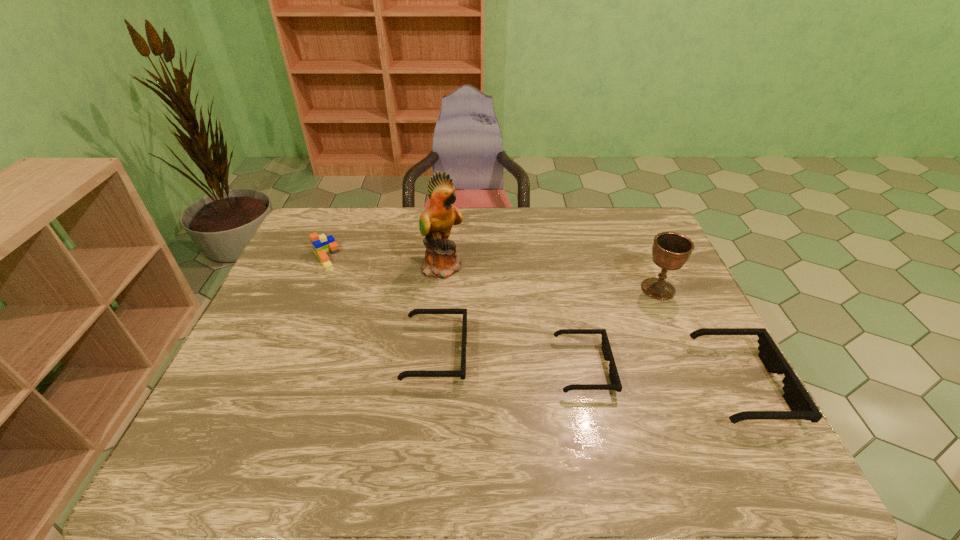
You are a GUI agent. You are given a task and a screenshot of the screen. Output one action in this format:
    pyautogui.click(x=<x>, y=<y>)
    Task: Click on the vacant space located on the front-facing side of the third object from right to left
    
    Given the screenshot: What is the action you would take?
    pyautogui.click(x=643, y=368)

I want to click on vacant region located 0.390m on the front-facing side of the parrot, so click(590, 266).

Find the location of a particular element. blank space located 0.120m on the right of the leftmost object is located at coordinates (375, 258).

Image resolution: width=960 pixels, height=540 pixels. Identify the location of vacant space located on the back of the chalice. (624, 214).

In order to click on object located in the far edge section of the desktop in this screenshot , I will do `click(321, 244)`.

This screenshot has height=540, width=960. I want to click on object situated at the left edge, so 321,244.

This screenshot has width=960, height=540. I want to click on sunglasses at the right edge, so click(802, 407).

I want to click on chalice situated at the right edge, so click(x=670, y=250).

Find the location of a particular element. This screenshot has width=960, height=540. object at the far left corner is located at coordinates click(x=321, y=244).

Image resolution: width=960 pixels, height=540 pixels. I want to click on object positioned at the near right corner, so click(x=802, y=407).